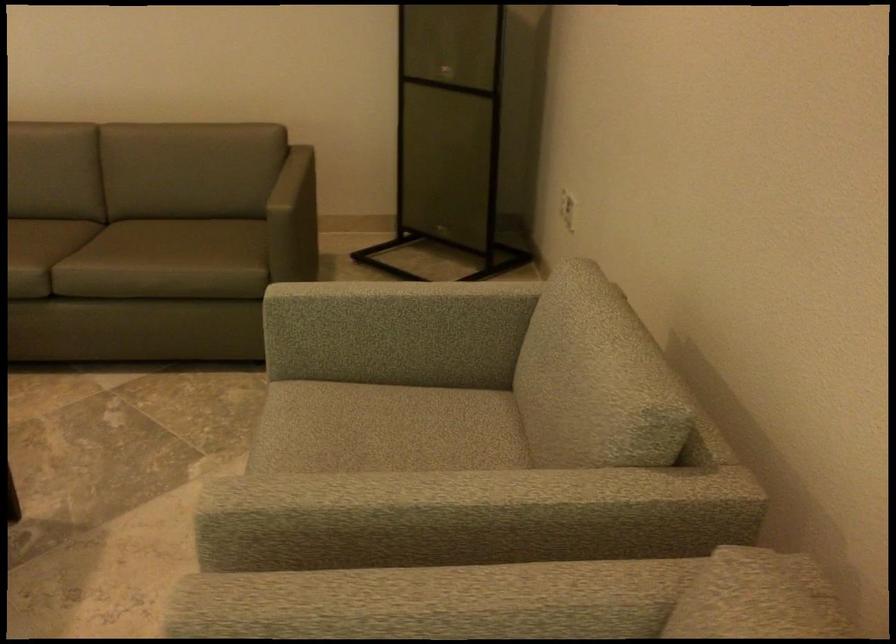
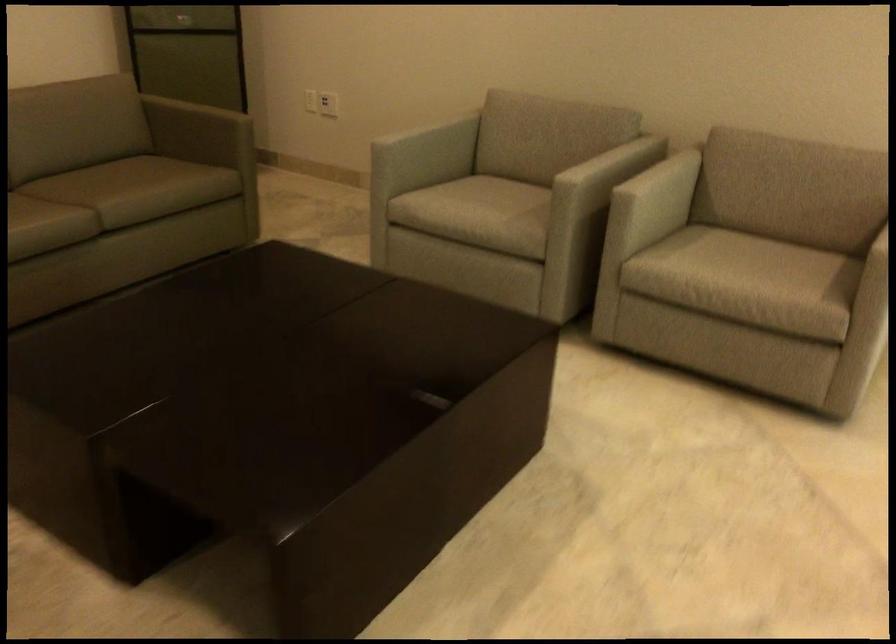
The point at (314, 478) is marked in the first image. Where is the corresponding point in the second image?

(480, 207)